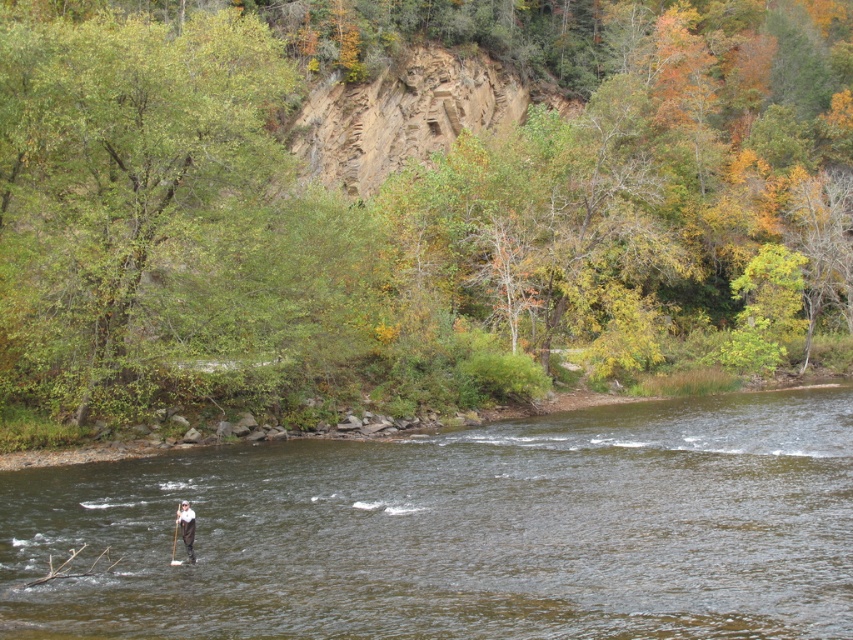
Question: Is green leafy tree at upper center to the left of wooden paddle at center from the viewer's perspective?

Choices:
 (A) yes
 (B) no

Answer: (B)

Question: Which object is farther from the camera taking this photo?

Choices:
 (A) brown water at center
 (B) green leafy tree at upper center
 (C) dark gray fabric person at center

Answer: (B)

Question: Can you confirm if green leafy tree at upper center is positioned below wooden paddle at center?

Choices:
 (A) yes
 (B) no

Answer: (B)

Question: Is green leafy tree at upper center thinner than brown water at center?

Choices:
 (A) yes
 (B) no

Answer: (B)

Question: Which object is the closest to the brown water at center?

Choices:
 (A) wooden paddle at center
 (B) green leafy tree at upper center
 (C) dark gray fabric person at center

Answer: (A)

Question: Which object is positioned closest to the green leafy tree at upper center?

Choices:
 (A) dark gray fabric person at center
 (B) brown water at center
 (C) wooden paddle at center

Answer: (B)